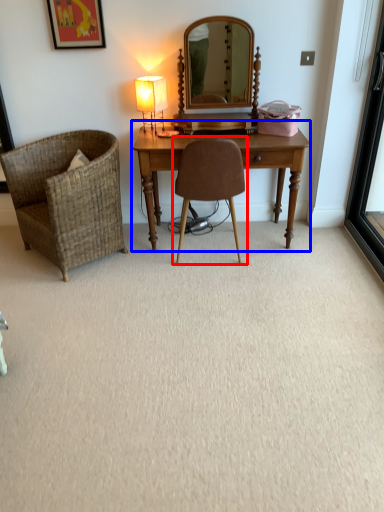
Question: Which point is closer to the camera, chair (highlighted by a red box) or table (highlighted by a blue box)?

Choices:
 (A) chair
 (B) table

Answer: (A)